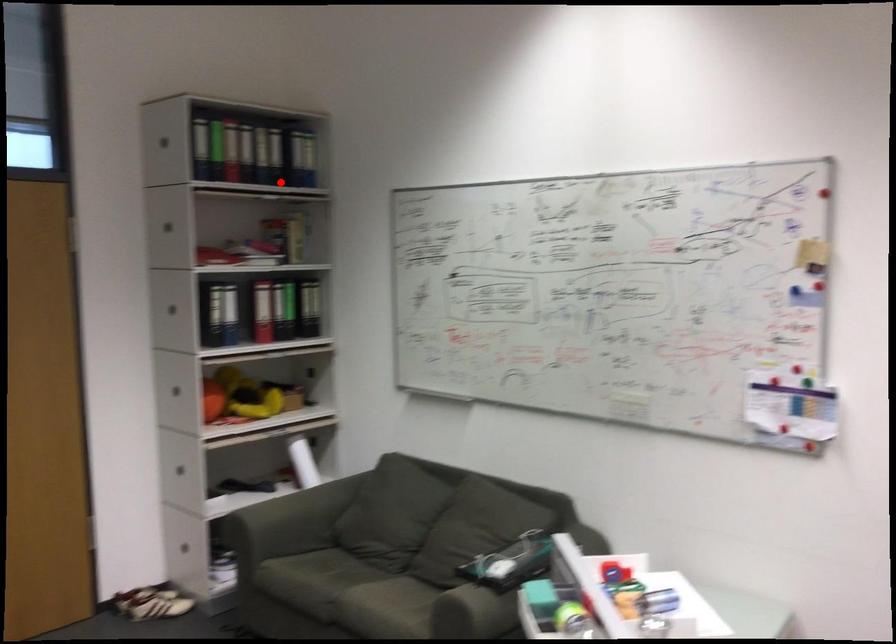
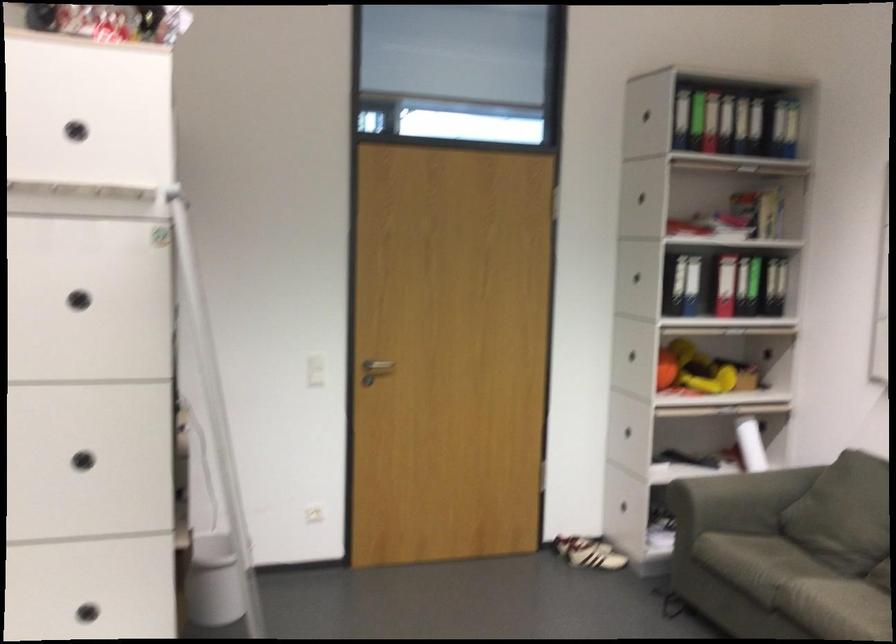
Question: I am providing you with two images of the same scene from different viewpoints. Given a red point in image1, look at the same physical point in image2. Is it:

Choices:
 (A) Closer to the viewpoint
 (B) Farther from the viewpoint

Answer: (A)